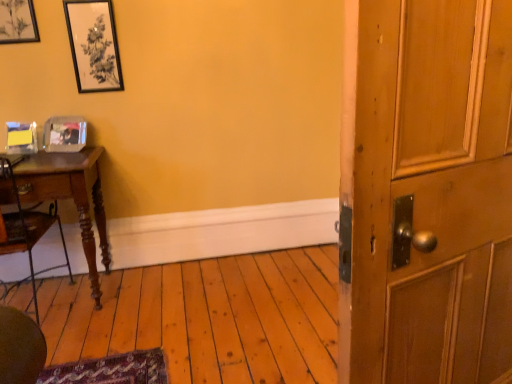
Question: Does matte black picture frame at upper left, the 1th picture frame from the top, have a lesser width compared to black matte picture frame at upper left, which ranks as the 2th picture frame in top-to-bottom order?

Choices:
 (A) no
 (B) yes

Answer: (A)

Question: Is matte black picture frame at upper left, the 3th picture frame ordered from the bottom, smaller than black matte picture frame at upper left, arranged as the second picture frame when ordered from the bottom?

Choices:
 (A) no
 (B) yes

Answer: (A)

Question: Is matte black picture frame at upper left, the 1th picture frame from the top, facing towards black matte picture frame at upper left, arranged as the second picture frame when ordered from the bottom?

Choices:
 (A) yes
 (B) no

Answer: (B)

Question: Can you confirm if matte black picture frame at upper left, the 3th picture frame ordered from the bottom, is shorter than black matte picture frame at upper left, arranged as the second picture frame when ordered from the bottom?

Choices:
 (A) yes
 (B) no

Answer: (A)

Question: From a real-world perspective, is matte black picture frame at upper left, the 1th picture frame from the top, positioned over black matte picture frame at upper left, which ranks as the 2th picture frame in top-to-bottom order, based on gravity?

Choices:
 (A) no
 (B) yes

Answer: (B)

Question: Looking at their shapes, would you say clear plastic picture frame at left, the 1th picture frame from the bottom, is wider or thinner than wooden desk at left?

Choices:
 (A) thin
 (B) wide

Answer: (A)

Question: Considering the relative positions of clear plastic picture frame at left, which is the third picture frame in top-to-bottom order, and wooden desk at left in the image provided, is clear plastic picture frame at left, which is the third picture frame in top-to-bottom order, to the left or to the right of wooden desk at left?

Choices:
 (A) left
 (B) right

Answer: (B)

Question: Relative to wooden desk at left, is clear plastic picture frame at left, which is the third picture frame in top-to-bottom order, in front or behind?

Choices:
 (A) behind
 (B) front

Answer: (A)

Question: Considering the positions of clear plastic picture frame at left, which is the third picture frame in top-to-bottom order, and wooden desk at left in the image, is clear plastic picture frame at left, which is the third picture frame in top-to-bottom order, bigger or smaller than wooden desk at left?

Choices:
 (A) small
 (B) big

Answer: (A)

Question: Based on their sizes in the image, would you say matte black picture frame at upper left, the 3th picture frame ordered from the bottom, is bigger or smaller than clear plastic picture frame at left, the 1th picture frame from the bottom?

Choices:
 (A) small
 (B) big

Answer: (A)

Question: Considering the positions of matte black picture frame at upper left, the 3th picture frame ordered from the bottom, and clear plastic picture frame at left, the 1th picture frame from the bottom, in the image, is matte black picture frame at upper left, the 3th picture frame ordered from the bottom, wider or thinner than clear plastic picture frame at left, the 1th picture frame from the bottom,?

Choices:
 (A) thin
 (B) wide

Answer: (A)

Question: From a real-world perspective, is matte black picture frame at upper left, the 3th picture frame ordered from the bottom, above or below clear plastic picture frame at left, the 1th picture frame from the bottom?

Choices:
 (A) below
 (B) above

Answer: (B)

Question: In terms of height, does matte black picture frame at upper left, the 1th picture frame from the top, look taller or shorter compared to clear plastic picture frame at left, the 1th picture frame from the bottom?

Choices:
 (A) short
 (B) tall

Answer: (B)

Question: From their relative heights in the image, would you say matte black picture frame at upper left, the 3th picture frame ordered from the bottom, is taller or shorter than black matte picture frame at upper left, arranged as the second picture frame when ordered from the bottom?

Choices:
 (A) tall
 (B) short

Answer: (B)

Question: Relative to black matte picture frame at upper left, which ranks as the 2th picture frame in top-to-bottom order, is matte black picture frame at upper left, the 1th picture frame from the top, in front or behind?

Choices:
 (A) behind
 (B) front

Answer: (B)